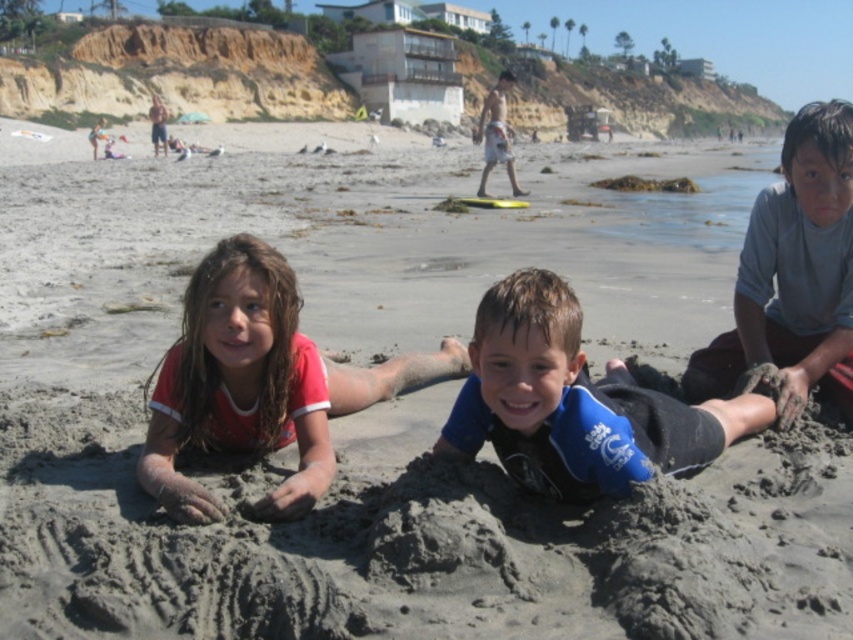
You are a photographer trying to capture a group photo of the wet red shirt at center and the gray matte shirt at center. Since the shirts are different in width, which one should you focus on to ensure it fits within the camera frame without cropping?

The wet red shirt at center is thinner than the gray matte shirt at center, so you should focus on the gray matte shirt at center to ensure it fits within the camera frame without cropping.

You are a photographer trying to capture a candid shot of the gray matte shirt at center without the wet red shirt at center blocking the view. Is this possible given their positions?

The wet red shirt at center is in front of the gray matte shirt at center, so it would block the view of the gray matte shirt at center. Therefore, capturing a candid shot of the gray matte shirt at center without the wet red shirt at center blocking the view is not possible.

You are a photographer trying to capture a group photo of the children. The children are positioned such that the wet red shirt at center and the gray matte shirt at center are both in the frame. Based on their positions, which child should you focus on first to ensure both are in focus?

The wet red shirt at center is located below the gray matte shirt at center. To ensure both are in focus, you should focus on the gray matte shirt at center first since it is higher up and closer to the background, allowing the wet red shirt at center to fall within the depth of field.